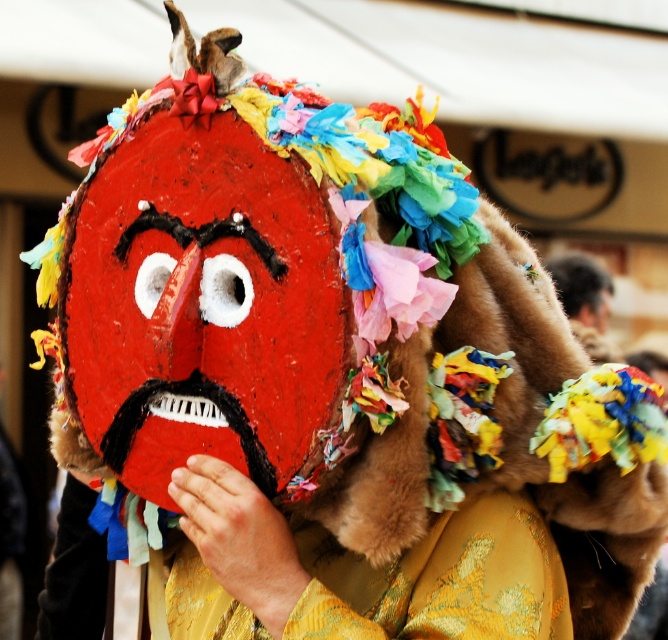
Can you confirm if matte red mask at center is positioned below furry head at upper right?

Yes.

Can you confirm if matte red mask at center is positioned above furry head at upper right?

No.

This screenshot has height=640, width=668. Identify the location of matte red mask at center. (178, 320).

The image size is (668, 640). I want to click on matte red mask at center, so click(x=178, y=320).

Is matte papier-mâché mask at center above multicolored paper mask at center?

Correct, matte papier-mâché mask at center is located above multicolored paper mask at center.

Can you confirm if matte papier-mâché mask at center is wider than multicolored paper mask at center?

No, matte papier-mâché mask at center is not wider than multicolored paper mask at center.

The width and height of the screenshot is (668, 640). Identify the location of matte papier-mâché mask at center. (200, 307).

Between matte red mask at center and multicolored paper mask at center, which one is positioned higher?

matte red mask at center

Is matte red mask at center in front of multicolored paper mask at center?

That is False.

Who is more distant from viewer, (158,342) or (653,371)?

The point (653,371) is more distant.

Find the location of a particular element. This screenshot has height=640, width=668. matte red mask at center is located at coordinates (178, 320).